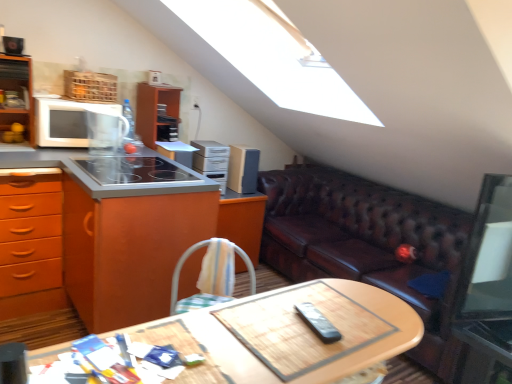
What do you see at coordinates (486, 351) in the screenshot?
I see `metallic silver side table at lower right` at bounding box center [486, 351].

This screenshot has height=384, width=512. Describe the element at coordinates (362, 239) in the screenshot. I see `brown leather couch at right` at that location.

Locate an element on the screen. Image resolution: width=512 pixels, height=384 pixels. brown leather couch at right is located at coordinates coord(362,239).

What do you see at coordinates (258, 358) in the screenshot? This screenshot has width=512, height=384. I see `wooden at center` at bounding box center [258, 358].

At what (x,y) coordinates should I click in order to perform the action: click on satin silver cabinet at upper center, the second appliance in the left-to-right sequence. Please return your answer as a coordinate pair (x, y). Looking at the image, I should click on (212, 161).

Measure the distance between point (221, 146) and camera.

Point (221, 146) and camera are 9.96 feet apart.

The height and width of the screenshot is (384, 512). What are the coordinates of `white matte microwave at left` in the screenshot? It's located at (66, 121).

The height and width of the screenshot is (384, 512). What do you see at coordinates (177, 152) in the screenshot? I see `satin silver toaster at center, positioned as the third appliance in back-to-front order` at bounding box center [177, 152].

Identify the location of metallic silver side table at lower right. (486, 351).

Between point (185, 296) and point (194, 147), which one is positioned behind?

Point (194, 147)

Is orange wood cabinet at left not within satin silver toaster at center, positioned as the third appliance in back-to-front order?

That's correct, orange wood cabinet at left is outside of satin silver toaster at center, positioned as the third appliance in back-to-front order.

Based on the photo, measure the distance between orange wood cabinet at left and satin silver toaster at center, the first appliance in the left-to-right sequence.

The distance of orange wood cabinet at left from satin silver toaster at center, the first appliance in the left-to-right sequence, is 67.06 centimeters.

Is white matte microwave at left surrounding smooth glass cooktop at center left?

No, smooth glass cooktop at center left is not surrounded by white matte microwave at left.

What's the angular difference between white matte microwave at left and smooth glass cooktop at center left's facing directions?

The facing directions of white matte microwave at left and smooth glass cooktop at center left are 90 degrees apart.

Which is more to the right, white matte microwave at left or smooth glass cooktop at center left?

Positioned to the right is smooth glass cooktop at center left.

Does white matte microwave at left turn towards smooth glass cooktop at center left?

Yes, white matte microwave at left is oriented towards smooth glass cooktop at center left.

Based on their sizes in the image, would you say satin silver cabinet at upper center, the second appliance in the left-to-right sequence, is bigger or smaller than black plastic remote at center, which is counted as the 4th appliance, starting from the back?

satin silver cabinet at upper center, the second appliance in the left-to-right sequence, is bigger than black plastic remote at center, which is counted as the 4th appliance, starting from the back.

Is satin silver cabinet at upper center, the second appliance in the left-to-right sequence, oriented towards black plastic remote at center, which is counted as the 4th appliance, starting from the back?

No, satin silver cabinet at upper center, the second appliance in the left-to-right sequence, does not turn towards black plastic remote at center, which is counted as the 4th appliance, starting from the back.

Is satin silver cabinet at upper center, the third appliance positioned from the right, spatially inside black plastic remote at center, the fourth appliance in the left-to-right sequence, or outside of it?

satin silver cabinet at upper center, the third appliance positioned from the right, exists outside the volume of black plastic remote at center, the fourth appliance in the left-to-right sequence.

From the image's perspective, who appears lower, satin silver cabinet at upper center, the third appliance positioned from the right, or black plastic remote at center, which is counted as the 4th appliance, starting from the back?

black plastic remote at center, which is counted as the 4th appliance, starting from the back.

Is point (500, 347) positioned in front of point (178, 175)?

Yes, point (500, 347) is closer to viewer.

Could you tell me if metallic silver side table at lower right is facing smooth glass cooktop at center left?

No, metallic silver side table at lower right is not aimed at smooth glass cooktop at center left.

This screenshot has height=384, width=512. I want to click on gas stove above the metallic silver side table at lower right (from a real-world perspective), so coord(133,170).

Considering the sizes of objects smooth glass cooktop at center left and orange wood cabinet at left in the image provided, who is taller, smooth glass cooktop at center left or orange wood cabinet at left?

orange wood cabinet at left is taller.

Who is bigger, smooth glass cooktop at center left or orange wood cabinet at left?

orange wood cabinet at left.

Is smooth glass cooktop at center left looking in the opposite direction of orange wood cabinet at left?

Absolutely, smooth glass cooktop at center left is directed away from orange wood cabinet at left.

Is smooth glass cooktop at center left wider than orange wood cabinet at left?

No.

Which of these two, satin silver toaster at center, the 2th appliance positioned from the front, or satin silver cabinet at upper center, acting as the 2th appliance starting from the back, stands taller?

satin silver cabinet at upper center, acting as the 2th appliance starting from the back, is taller.

Does satin silver toaster at center, the first appliance in the left-to-right sequence, have a lesser width compared to satin silver cabinet at upper center, the second appliance in the left-to-right sequence?

In fact, satin silver toaster at center, the first appliance in the left-to-right sequence, might be wider than satin silver cabinet at upper center, the second appliance in the left-to-right sequence.

From a real-world perspective, is satin silver toaster at center, the first appliance in the left-to-right sequence, positioned above or below satin silver cabinet at upper center, the second appliance in the left-to-right sequence?

Clearly, from a real-world perspective, satin silver toaster at center, the first appliance in the left-to-right sequence, is above satin silver cabinet at upper center, the second appliance in the left-to-right sequence.

From a real-world perspective, which is physically below, brown leather couch at right or orange wood cabinet at left?

In real-world perspective, brown leather couch at right is lower.

Is brown leather couch at right located outside orange wood cabinet at left?

Yes, brown leather couch at right is not within orange wood cabinet at left.

In the scene shown: Which point is more distant from viewer, (298, 195) or (103, 306)?

The point (298, 195) is farther from the camera.

Is brown leather couch at right far from orange wood cabinet at left?

Yes, brown leather couch at right is far from orange wood cabinet at left.

At what (x,y) coordinates should I click in order to perform the action: click on the 1st appliance behind the orange wood cabinet at left. Please return your answer as a coordinate pair (x, y). Image resolution: width=512 pixels, height=384 pixels. Looking at the image, I should click on (177, 152).

The height and width of the screenshot is (384, 512). Identify the location of microwave oven on the left of smooth glass cooktop at center left. (66, 121).

Which object lies nearer to the anchor point satin silver cabinet at upper center, acting as the 2th appliance starting from the back, smooth glass cooktop at center left or wooden at center?

Based on the image, smooth glass cooktop at center left appears to be nearer to satin silver cabinet at upper center, acting as the 2th appliance starting from the back.

Considering their positions, is satin silver cabinet at upper center, the second appliance in the left-to-right sequence, positioned closer to smooth glass cooktop at center left than metallic silver side table at lower right?

Based on the image, satin silver cabinet at upper center, the second appliance in the left-to-right sequence, appears to be nearer to smooth glass cooktop at center left.

From the image, which object appears to be farther from brown leather couch at right, black plastic remote at center, which appears as the 1th appliance when viewed from the front, or satin silver cabinet at upper center, the second appliance in the left-to-right sequence?

black plastic remote at center, which appears as the 1th appliance when viewed from the front, is further to brown leather couch at right.

Which object lies nearer to the anchor point smooth glass cooktop at center left, orange wood cabinet at left or satin silver cabinet at upper center, acting as the 2th appliance starting from the back?

The object closer to smooth glass cooktop at center left is orange wood cabinet at left.

Looking at the image, which one is located closer to orange wood cabinet at left, smooth glass cooktop at center left or brown leather couch at right?

Based on the image, smooth glass cooktop at center left appears to be nearer to orange wood cabinet at left.

When comparing their distances from wooden at center, does satin silver cabinet at upper center, the second appliance in the left-to-right sequence, or smooth glass cooktop at center left seem further?

satin silver cabinet at upper center, the second appliance in the left-to-right sequence, lies further to wooden at center than the other object.

Estimate the real-world distances between objects in this image. Which object is further from black plastic remote at center, the fourth appliance in the left-to-right sequence, metallic silver side table at lower right or brown leather couch at right?

brown leather couch at right is positioned further to the anchor black plastic remote at center, the fourth appliance in the left-to-right sequence.

Estimate the real-world distances between objects in this image. Which object is further from white matte microwave at left, wooden at center or satin silver toaster at center, the first appliance in the left-to-right sequence?

wooden at center lies further to white matte microwave at left than the other object.

Find the location of a particular element. The image size is (512, 384). microwave oven located between orange wood cabinet at left and satin silver toaster at center, the first appliance in the left-to-right sequence, in the depth direction is located at coordinates (66, 121).

Identify the location of cabinetry between wooden at center and satin silver cabinet at upper center, the second appliance in the left-to-right sequence, in the front-back direction. (136, 230).

This screenshot has width=512, height=384. Identify the location of gas stove located between orange wood cabinet at left and white matte microwave at left in the depth direction. (133, 170).

The height and width of the screenshot is (384, 512). I want to click on studio couch situated between smooth glass cooktop at center left and metallic silver side table at lower right from left to right, so click(362, 239).